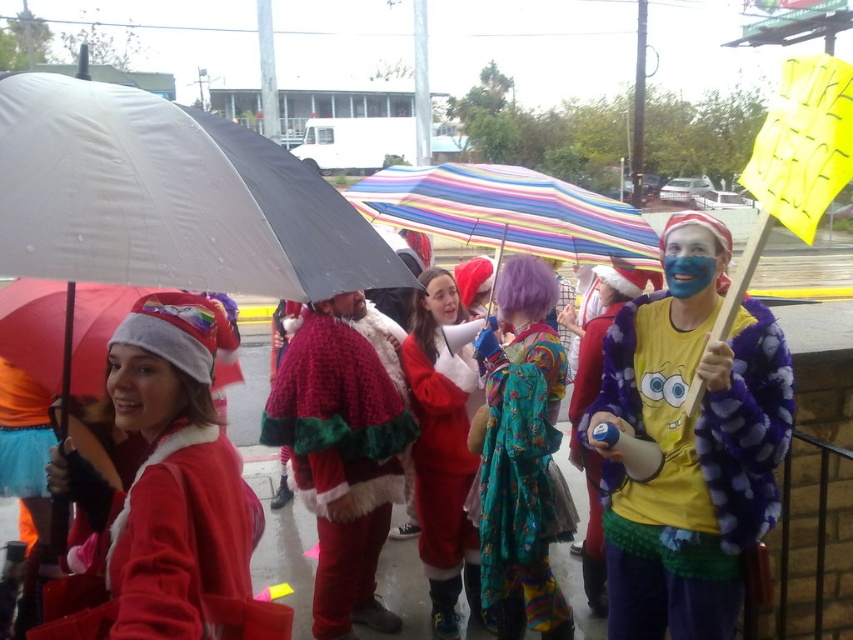
Question: Which object is the closest to the fluffy purple coat at center-right?

Choices:
 (A) velvet red coat at center
 (B) velvet-like red santa suit at center
 (C) velvet santa suit at center

Answer: (A)

Question: Among these objects, which one is nearest to the camera?

Choices:
 (A) velvet-like red santa suit at center
 (B) white matte umbrella at left
 (C) fluffy purple coat at center-right

Answer: (B)

Question: Is multicolored fabric dress at center to the right of fluffy purple coat at center-right from the viewer's perspective?

Choices:
 (A) yes
 (B) no

Answer: (B)

Question: From the image, what is the correct spatial relationship of white matte umbrella at left in relation to velvet-like red santa suit at center?

Choices:
 (A) right
 (B) left

Answer: (B)

Question: Which of these objects is positioned closest to the multicolored fabric dress at center?

Choices:
 (A) velvet red coat at center
 (B) velvet santa suit at center

Answer: (A)

Question: Can you confirm if white matte umbrella at left is bigger than velvet santa suit at center?

Choices:
 (A) yes
 (B) no

Answer: (A)